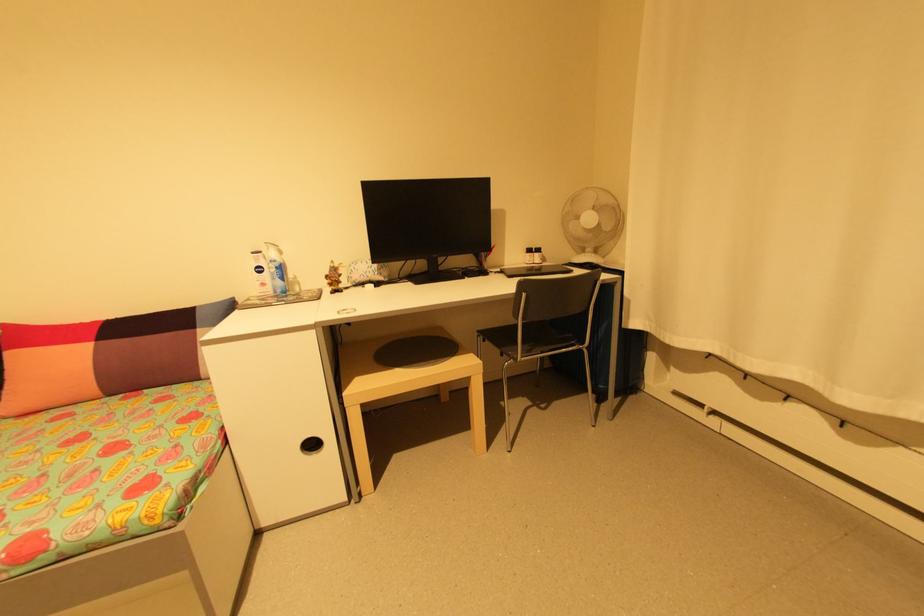
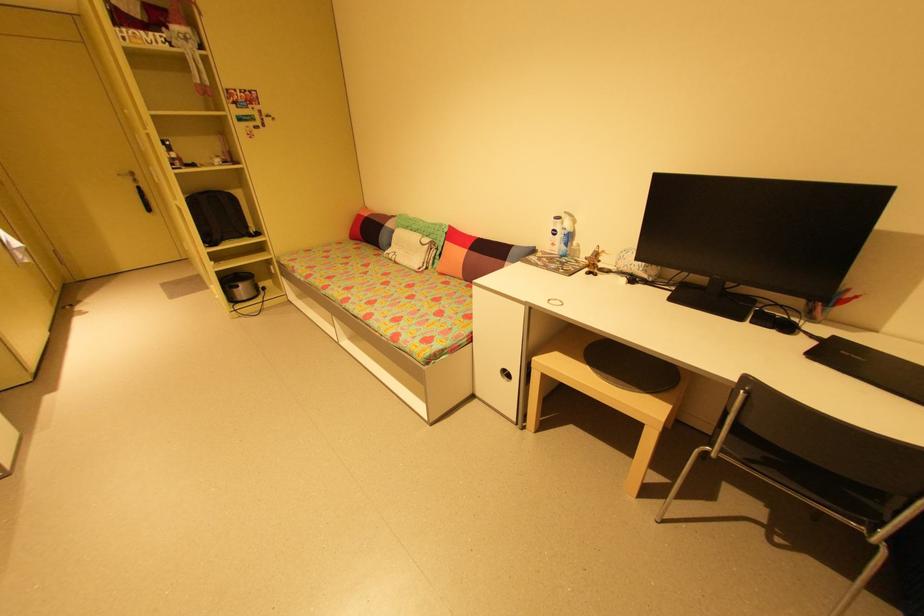
Where in the second image is the point corresponding to (338,280) from the first image?

(597, 262)